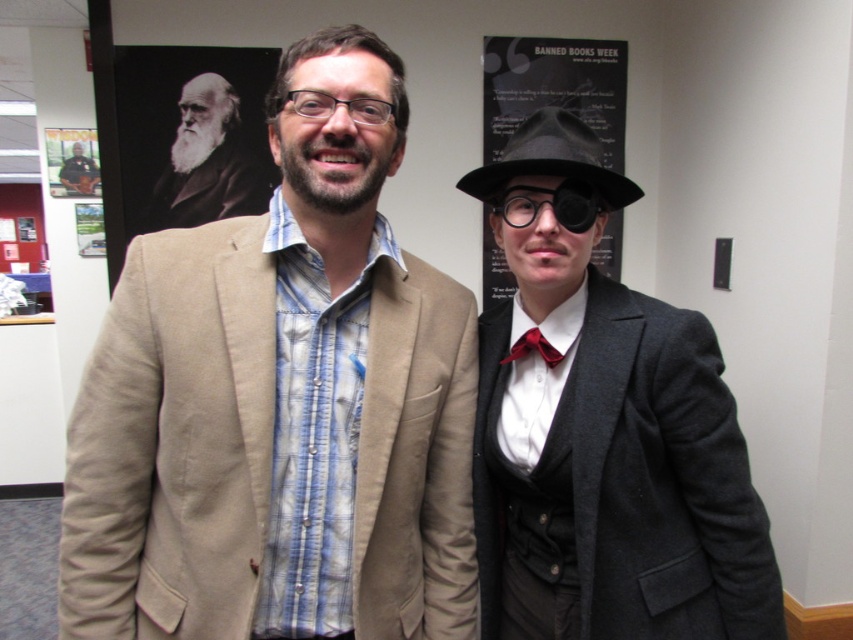
You are at an event and want to take a photo of both the black matte poster at upper center and the matte red bow tie at center. Which object should you focus on first to ensure both are in the frame?

You should focus on the black matte poster at upper center first since it is closer to you than the matte red bow tie at center, ensuring both are in the frame.

What is located at the coordinate point (x=281, y=401) in the image?

The tan fabric jacket at center is located at the coordinate point (x=281, y=401).